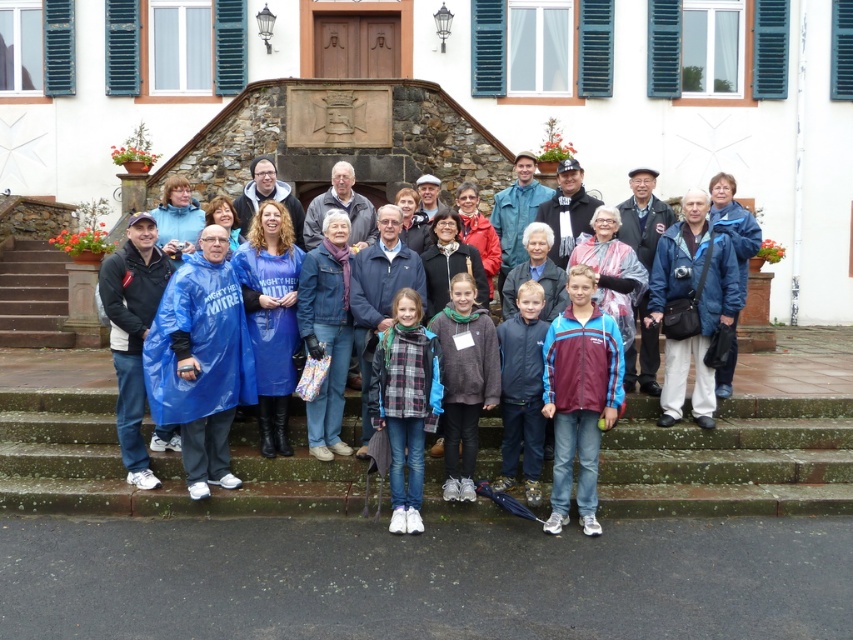
Question: Is concrete stairs at center bigger than blue/white striped jacket at center?

Choices:
 (A) yes
 (B) no

Answer: (B)

Question: Is blue/white striped jacket at center positioned at the back of blue waterproof poncho at center?

Choices:
 (A) no
 (B) yes

Answer: (A)

Question: Which point appears closest to the camera in this image?

Choices:
 (A) (326, 477)
 (B) (604, 368)
 (C) (59, 333)
 (D) (701, 339)

Answer: (B)

Question: Which of the following is the closest to the observer?

Choices:
 (A) (664, 365)
 (B) (648, 461)

Answer: (B)

Question: Observing the image, what is the correct spatial positioning of concrete stairs at center in reference to blue fabric jacket at center?

Choices:
 (A) above
 (B) below

Answer: (B)

Question: Which object is closer to the camera taking this photo?

Choices:
 (A) brown stone stairs at left
 (B) blue/white striped jacket at center
 (C) blue waterproof poncho at center
 (D) concrete stairs at center

Answer: (B)